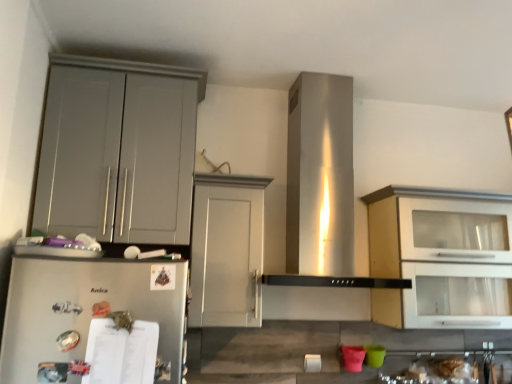
Question: Which direction should I rotate to look at white matte cabinet at center, marked as the second cabinetry in a left-to-right arrangement?

Choices:
 (A) right
 (B) left

Answer: (B)

Question: Could matte gray cabinet at left, which ranks as the first cabinetry in left-to-right order, be considered to be inside white glossy cabinet at upper right, which appears as the third cabinetry when viewed from the left?

Choices:
 (A) yes
 (B) no

Answer: (B)

Question: From the image's perspective, would you say white glossy cabinet at upper right, marked as the 1th cabinetry in a right-to-left arrangement, is positioned over matte gray cabinet at left, arranged as the 3th cabinetry when viewed from the right?

Choices:
 (A) no
 (B) yes

Answer: (A)

Question: Can you confirm if white glossy cabinet at upper right, which appears as the third cabinetry when viewed from the left, is positioned to the right of matte gray cabinet at left, which ranks as the first cabinetry in left-to-right order?

Choices:
 (A) yes
 (B) no

Answer: (A)

Question: Can you confirm if white glossy cabinet at upper right, which appears as the third cabinetry when viewed from the left, is wider than matte gray cabinet at left, which ranks as the first cabinetry in left-to-right order?

Choices:
 (A) yes
 (B) no

Answer: (A)

Question: Is white glossy cabinet at upper right, which appears as the third cabinetry when viewed from the left, bigger than matte gray cabinet at left, which ranks as the first cabinetry in left-to-right order?

Choices:
 (A) yes
 (B) no

Answer: (A)

Question: Is white glossy cabinet at upper right, which appears as the third cabinetry when viewed from the left, aimed at matte gray cabinet at left, which ranks as the first cabinetry in left-to-right order?

Choices:
 (A) no
 (B) yes

Answer: (A)

Question: Could white glossy cabinet at upper right, marked as the 1th cabinetry in a right-to-left arrangement, be considered to be inside white matte cabinet at center, the second cabinetry in the right-to-left sequence?

Choices:
 (A) no
 (B) yes

Answer: (A)

Question: Is white matte cabinet at center, the second cabinetry in the right-to-left sequence, thinner than white glossy cabinet at upper right, which appears as the third cabinetry when viewed from the left?

Choices:
 (A) no
 (B) yes

Answer: (B)

Question: Considering the relative positions of white matte cabinet at center, marked as the second cabinetry in a left-to-right arrangement, and white glossy cabinet at upper right, marked as the 1th cabinetry in a right-to-left arrangement, in the image provided, is white matte cabinet at center, marked as the second cabinetry in a left-to-right arrangement, to the left of white glossy cabinet at upper right, marked as the 1th cabinetry in a right-to-left arrangement, from the viewer's perspective?

Choices:
 (A) no
 (B) yes

Answer: (B)

Question: Can you confirm if white matte cabinet at center, marked as the second cabinetry in a left-to-right arrangement, is positioned to the right of white glossy cabinet at upper right, marked as the 1th cabinetry in a right-to-left arrangement?

Choices:
 (A) no
 (B) yes

Answer: (A)

Question: Is white matte cabinet at center, the second cabinetry in the right-to-left sequence, outside white glossy cabinet at upper right, marked as the 1th cabinetry in a right-to-left arrangement?

Choices:
 (A) no
 (B) yes

Answer: (B)

Question: Could you tell me if white matte cabinet at center, marked as the second cabinetry in a left-to-right arrangement, is facing white glossy cabinet at upper right, which appears as the third cabinetry when viewed from the left?

Choices:
 (A) no
 (B) yes

Answer: (A)

Question: Considering the relative sizes of matte gray cabinet at left, arranged as the 3th cabinetry when viewed from the right, and satin silver refrigerator at lower left in the image provided, is matte gray cabinet at left, arranged as the 3th cabinetry when viewed from the right, bigger than satin silver refrigerator at lower left?

Choices:
 (A) yes
 (B) no

Answer: (A)